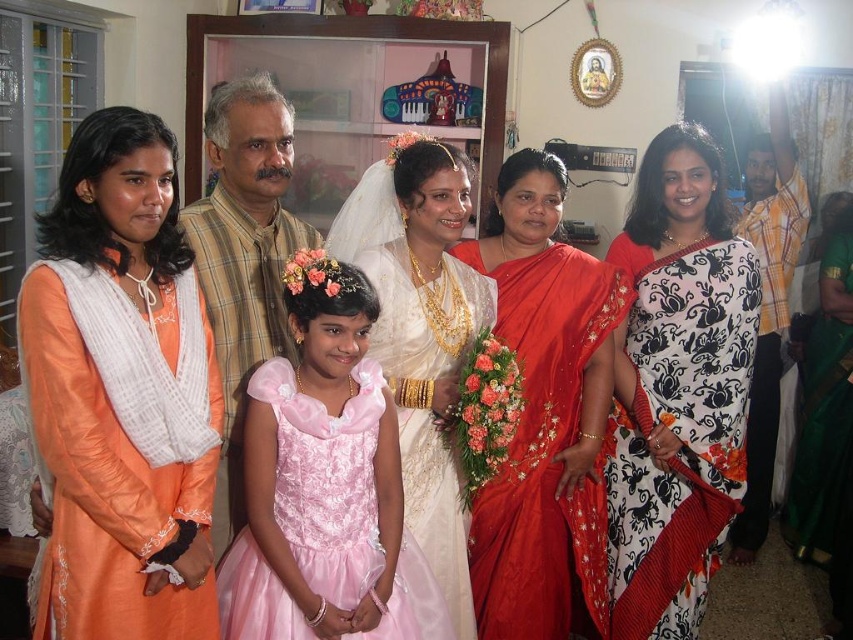
Question: Which point is farther to the camera?

Choices:
 (A) (379, 481)
 (B) (427, 198)

Answer: (B)

Question: Can you confirm if orange silk kurta at left is positioned below white printed saree at center?

Choices:
 (A) yes
 (B) no

Answer: (B)

Question: Which object appears closest to the camera in this image?

Choices:
 (A) light brown plaid shirt at center
 (B) orange silk kurta at left

Answer: (B)

Question: Can you confirm if white printed saree at center is positioned to the left of yellow checkered shirt at right?

Choices:
 (A) yes
 (B) no

Answer: (A)

Question: Can you confirm if pink satin dress at center is bigger than yellow checkered shirt at right?

Choices:
 (A) yes
 (B) no

Answer: (B)

Question: Which point is closer to the camera?

Choices:
 (A) white satin dress at center
 (B) orange silk kurta at left
 (C) yellow checkered shirt at right
 (D) light brown plaid shirt at center

Answer: (B)